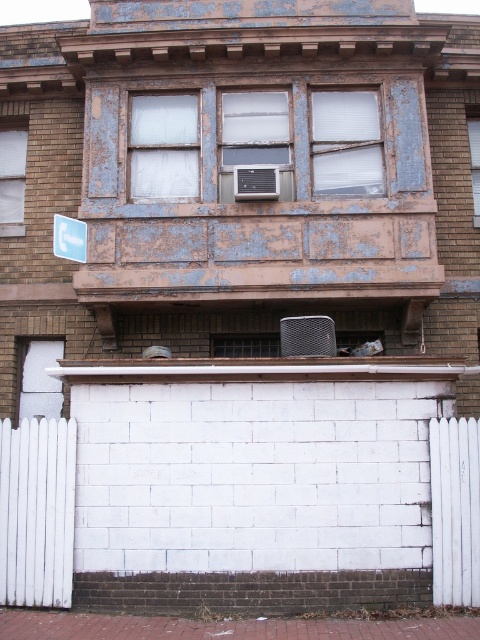
Question: In this image, where is transparent plastic window at center located relative to clear glass window at center?

Choices:
 (A) above
 (B) below

Answer: (A)

Question: Can you confirm if white frosted glass at upper center is thinner than clear glass window at upper center?

Choices:
 (A) yes
 (B) no

Answer: (B)

Question: Estimate the real-world distances between objects in this image. Which object is closer to the white matte door at lower left?

Choices:
 (A) clear glass window at upper center
 (B) white frosted glass at upper center

Answer: (B)

Question: Among these objects, which one is farthest from the camera?

Choices:
 (A) clear glass window at center
 (B) white matte door at lower left
 (C) white frosted glass at upper center
 (D) white plastic air conditioner at center

Answer: (B)

Question: From the image, what is the correct spatial relationship of white frosted glass at upper center in relation to clear glass window at upper center?

Choices:
 (A) above
 (B) below

Answer: (A)

Question: Which point appears farthest from the camera in this image?

Choices:
 (A) (0, 227)
 (B) (323, 193)

Answer: (A)